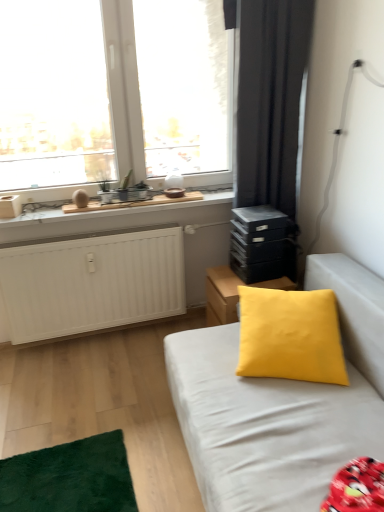
This screenshot has width=384, height=512. I want to click on free spot above yellow fabric cushion at center (from a real-world perspective), so tap(249, 280).